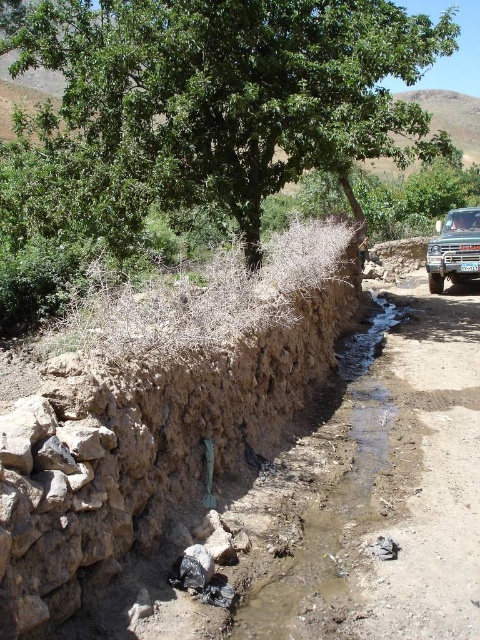
You are a delivery driver approaching the metallic silver truck at right. You need to park your vehicle near the green leafy tree at upper center. Based on the scene, can you determine if the truck is positioned higher or lower than the tree?

The green leafy tree at upper center is located above metallic silver truck at right, meaning the truck is positioned lower than the tree.

You are a hiker trying to cross the stream next to the embankment. You see the green leafy tree at upper center and the metallic silver truck at right. Which object is closer to you, and would the truck be visible from under the tree?

The green leafy tree at upper center is closer to you than the metallic silver truck at right. However, the truck may still be visible from under the tree depending on the tree branches and the terrain between them.

You are a hiker trying to navigate from the dry embankment to the tree on the left. You see two points marked on your map as point (81, 92) and point (470, 250). Which point is closer to the tree on the left?

Point (81, 92) is in front of point (470, 250), so it is closer to the tree on the left.